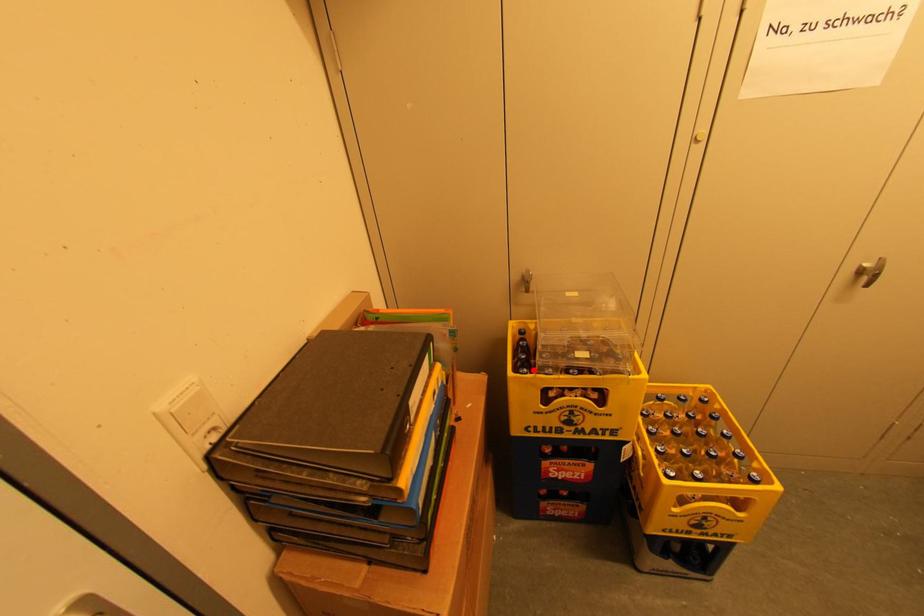
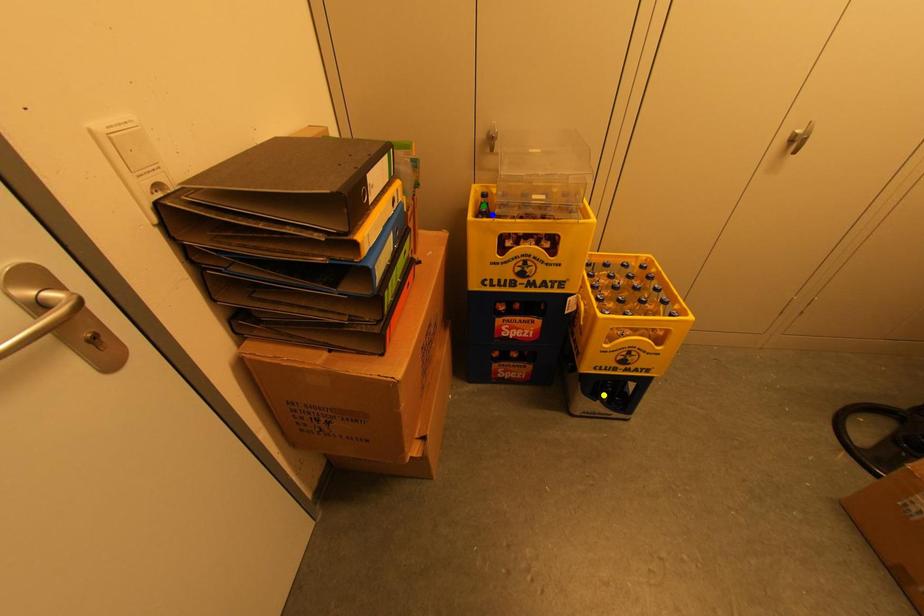
Question: I am providing you with two images of the same scene from different viewpoints. A red point is marked on the first image. You are given multiple points on the second image. Which point in image 2 is actually the same real-world point as the red point in image 1?

Choices:
 (A) green point
 (B) yellow point
 (C) blue point

Answer: (C)